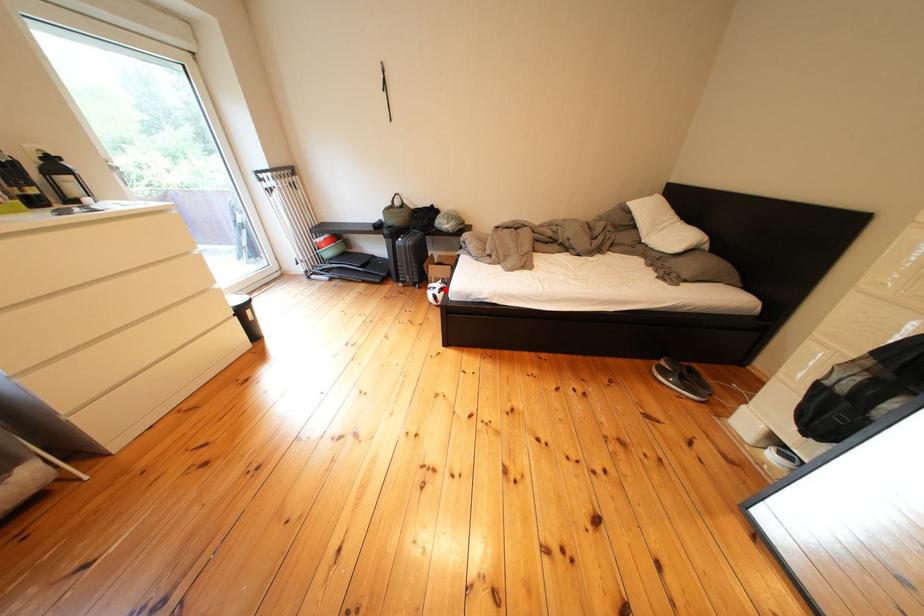
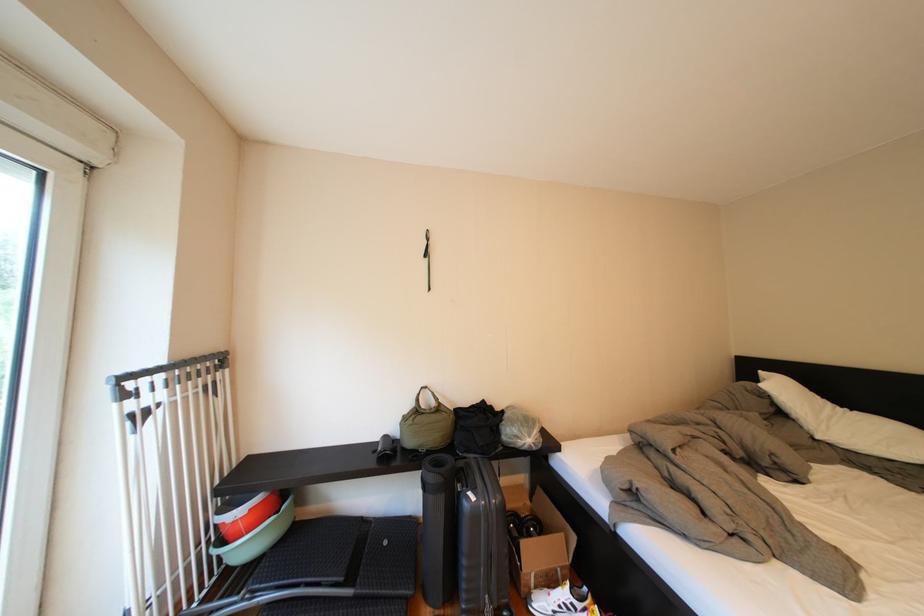
Question: I am providing you with two images of the same scene from different viewpoints. Image1 has a red point marked. In image2, the corresponding 3D location appears at what relative position? Reply with the corresponding letter.

Choices:
 (A) Closer
 (B) Farther

Answer: (A)